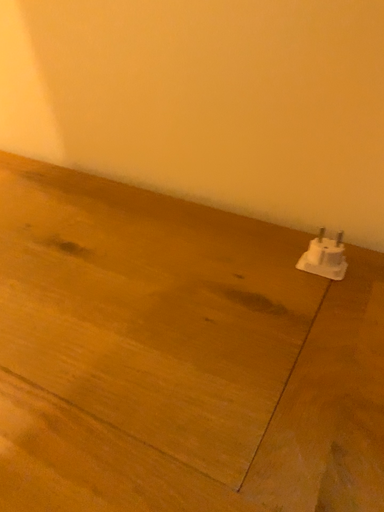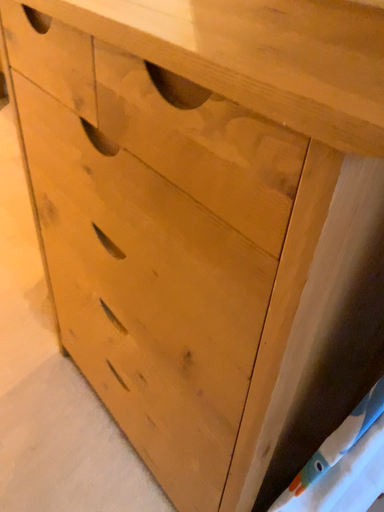
Question: Which way did the camera rotate in the video?

Choices:
 (A) rotated upward
 (B) rotated downward

Answer: (B)